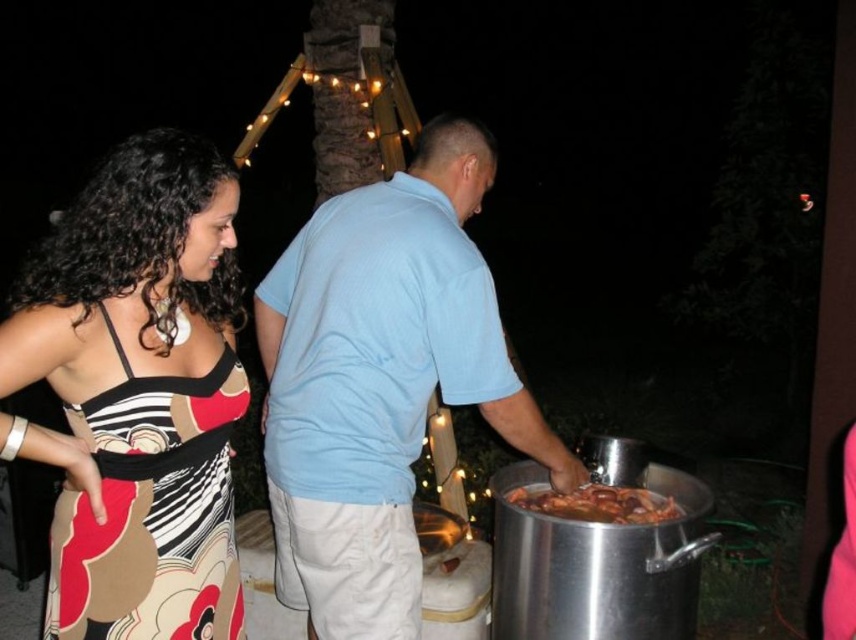
Can you confirm if light blue cotton shirt at center is positioned to the left of shiny metallic food at lower right?

Indeed, light blue cotton shirt at center is positioned on the left side of shiny metallic food at lower right.

The height and width of the screenshot is (640, 856). Find the location of `light blue cotton shirt at center`. light blue cotton shirt at center is located at coordinates pyautogui.click(x=381, y=380).

This screenshot has width=856, height=640. In order to click on light blue cotton shirt at center in this screenshot , I will do `click(381, 380)`.

Is point (140, 323) closer to viewer compared to point (372, 420)?

Yes, point (140, 323) is in front of point (372, 420).

Can you confirm if printed fabric dress at left is wider than light blue cotton shirt at center?

No.

Between point (173, 170) and point (508, 381), which one is positioned behind?

Point (508, 381)

What are the coordinates of `printed fabric dress at left` in the screenshot? It's located at (141, 390).

Does printed fabric dress at left have a greater width compared to shiny metallic food at lower right?

Incorrect, printed fabric dress at left's width does not surpass shiny metallic food at lower right's.

Is printed fabric dress at left taller than shiny metallic food at lower right?

Yes, printed fabric dress at left is taller than shiny metallic food at lower right.

Describe the element at coordinates (141, 390) in the screenshot. The width and height of the screenshot is (856, 640). I see `printed fabric dress at left` at that location.

Locate an element on the screen. printed fabric dress at left is located at coordinates (141, 390).